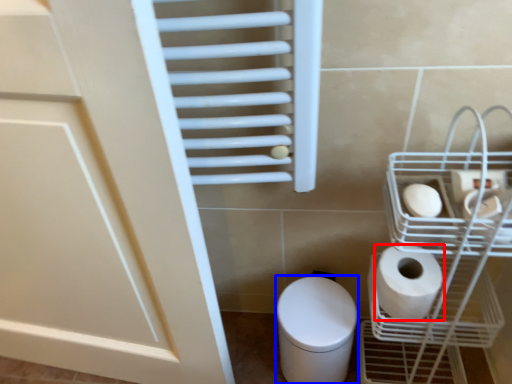
Question: Which of the following is the farthest to the observer, toilet paper (highlighted by a red box) or bidet (highlighted by a blue box)?

Choices:
 (A) toilet paper
 (B) bidet

Answer: (B)